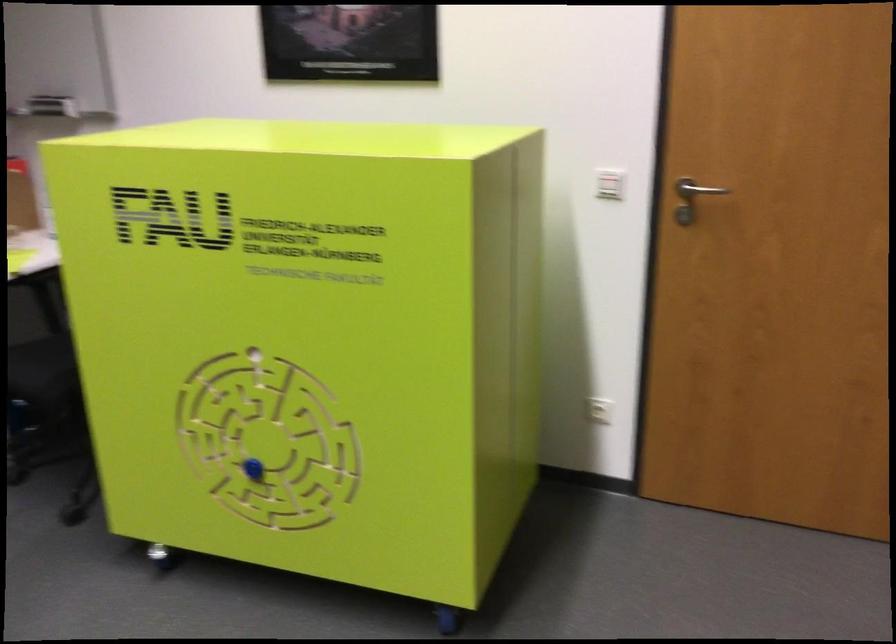
Locate an element on the screen. blue maze knob is located at coordinates (253, 469).